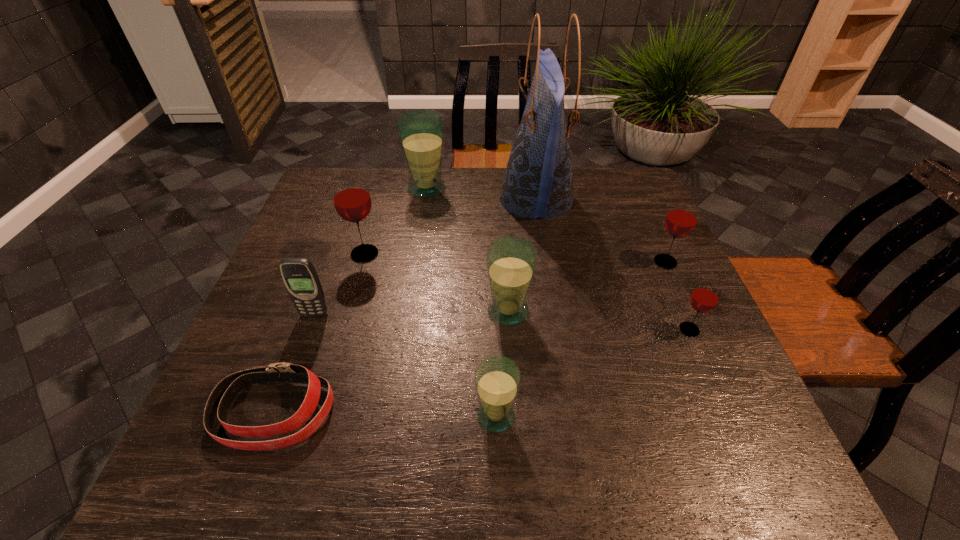
The image size is (960, 540). I want to click on the nearest glass, so click(x=497, y=378).

The width and height of the screenshot is (960, 540). What are the coordinates of `the smallest blue glass` in the screenshot? It's located at (497, 378).

Locate an element on the screen. This screenshot has height=540, width=960. dog collar is located at coordinates (223, 395).

Locate an element on the screen. The height and width of the screenshot is (540, 960). pink dog collar is located at coordinates (223, 395).

At what (x,y) coordinates should I click in order to perform the action: click on free spot located 0.320m on the left of the shopping bag. Please return your answer as a coordinate pair (x, y). This screenshot has height=540, width=960. Looking at the image, I should click on (394, 199).

Where is `free location located 0.330m on the front of the biggest red glass`? Image resolution: width=960 pixels, height=540 pixels. free location located 0.330m on the front of the biggest red glass is located at coordinates (329, 376).

Locate an element on the screen. The image size is (960, 540). free spot located on the right of the leftmost blue glass is located at coordinates [x=516, y=188].

The image size is (960, 540). I want to click on vacant space located 0.310m on the back of the second smallest red glass, so click(632, 188).

You are a GUI agent. You are given a task and a screenshot of the screen. Output one action in this format:
    pyautogui.click(x=<x>, y=<y>)
    Task: Click on the vacant space located on the left of the second smallest blue glass
    Image resolution: width=960 pixels, height=540 pixels.
    Given the screenshot: What is the action you would take?
    pyautogui.click(x=310, y=312)

This screenshot has height=540, width=960. Identify the location of vacant space located on the screen of the gray cellular telephone. (280, 410).